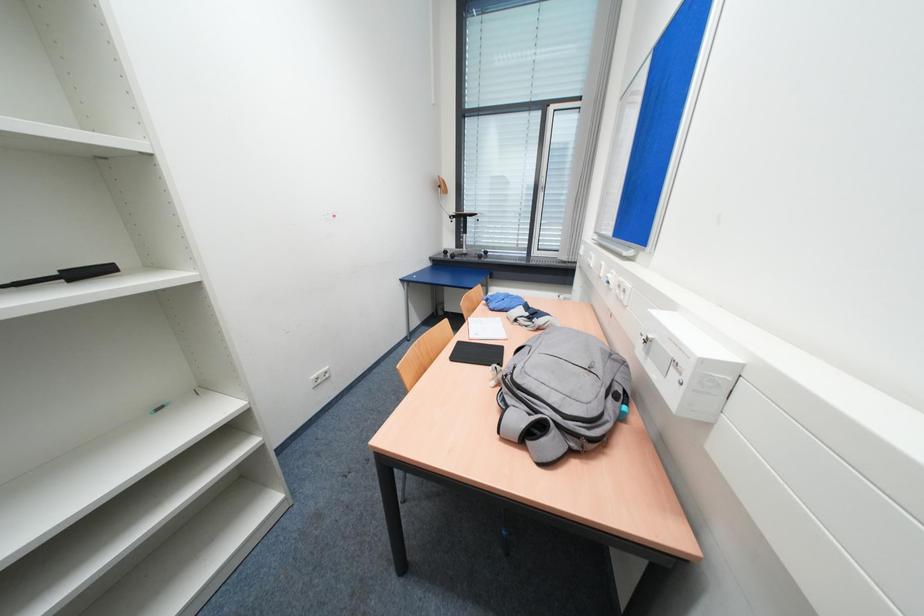
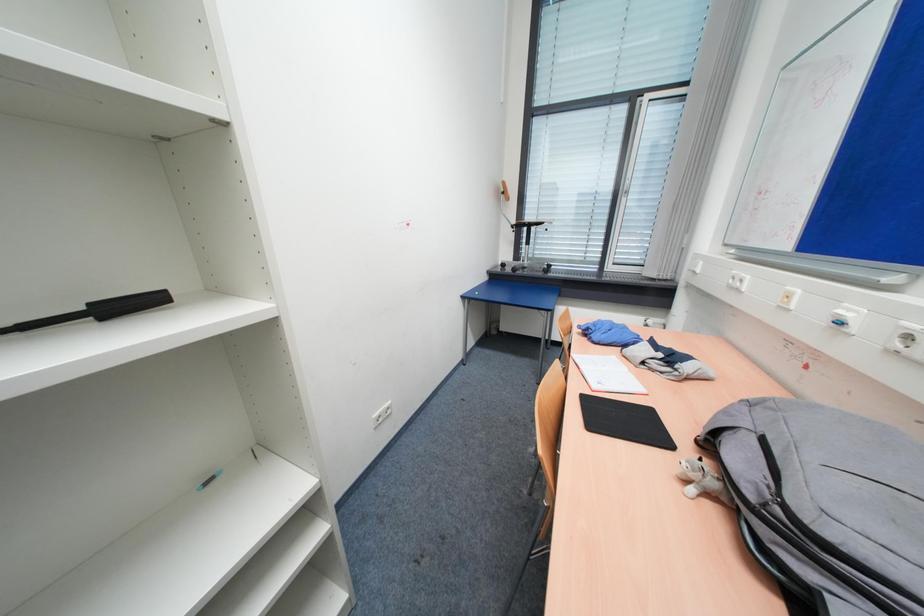
Question: The camera is either moving clockwise (left) or counter-clockwise (right) around the object. The first image is from the beginning of the video and the second image is from the end. Is the camera moving left or right when shooting the video?

Choices:
 (A) Left
 (B) Right

Answer: (B)